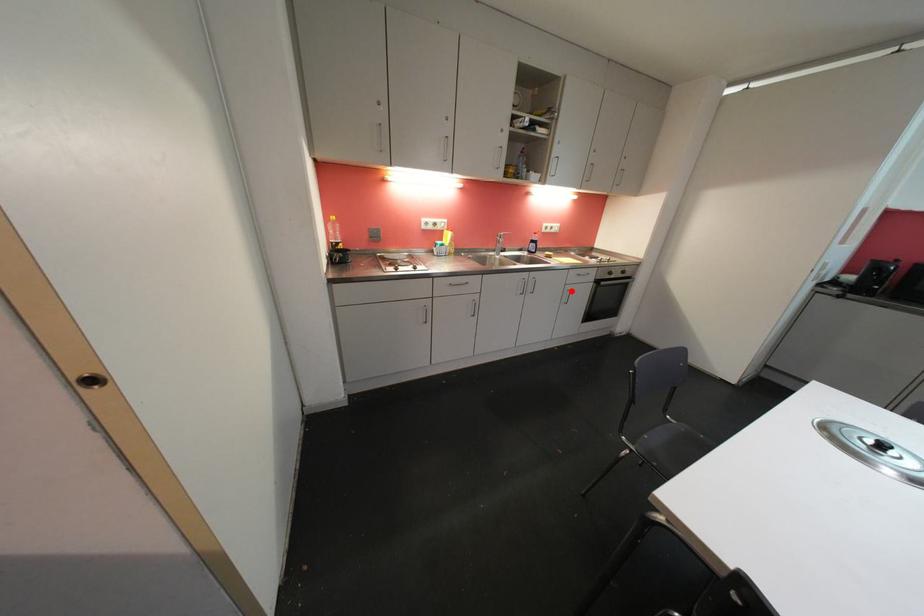
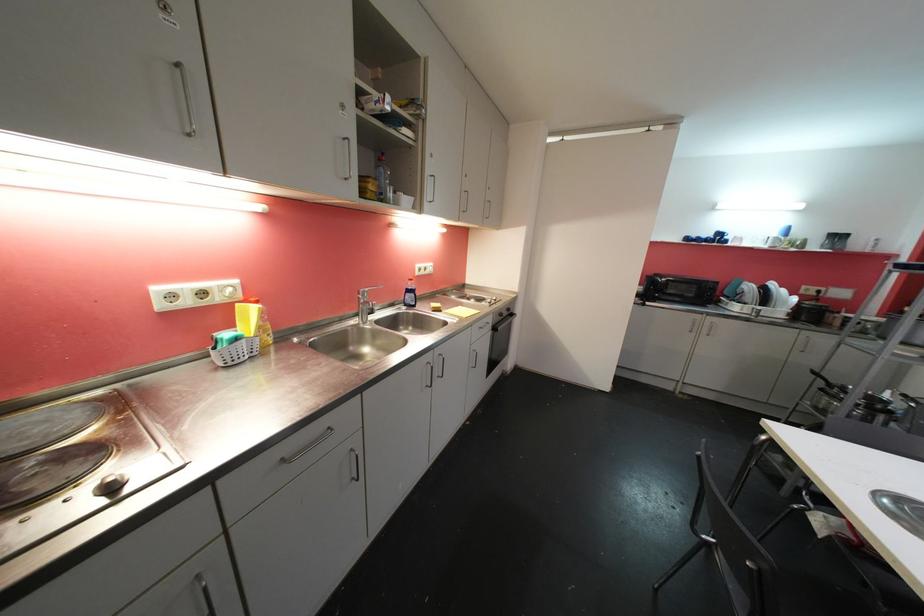
In the second image, find the point that corresponds to the highlighted location in the first image.

(477, 352)